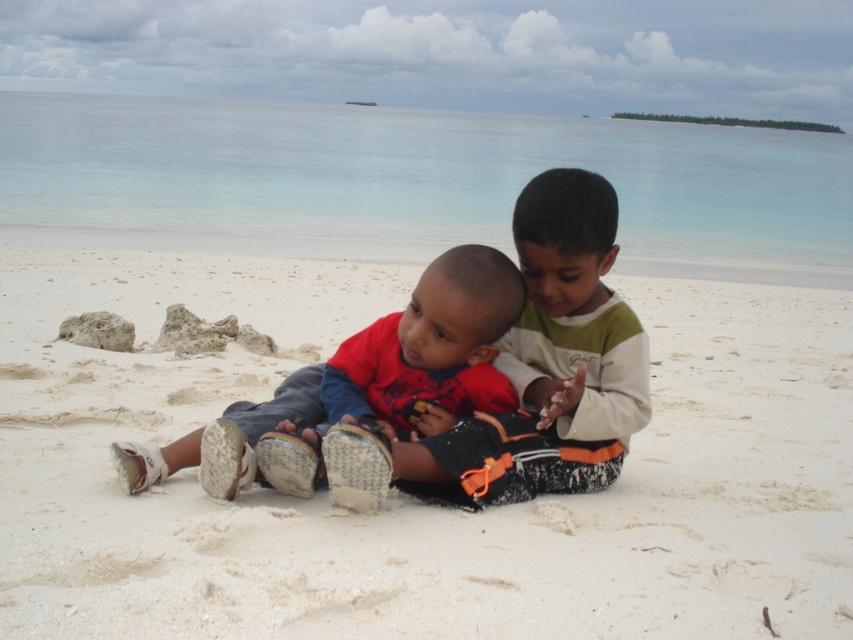
You are a drone operator trying to capture a photo of the children sitting on the white sandy beach at center. To ensure the beach is the main focus, where should you position the drone relative to the children?

The white sandy beach at center is located at point (409, 499), so you should position the drone slightly to the right and above the children to center the beach in the photo.

You are a drone operator trying to capture a photo of the two children on the beach. The first point you need to focus on is point 1 at point (x=318, y=624) and the second point is point 2 at point (x=352, y=381). Which point is closer to the ocean in this scene?

Point 1 at point (x=318, y=624) is closer to the ocean because it is in front of point 2 at point (x=352, y=381).

You are a photographer trying to capture a closeup of the white sandy beach at center and the matte red shirt at center. Which object takes up more area in the photo?

The matte red shirt at center takes up more area in the photo because the white sandy beach at center occupies less space than the matte red shirt at center according to the description.